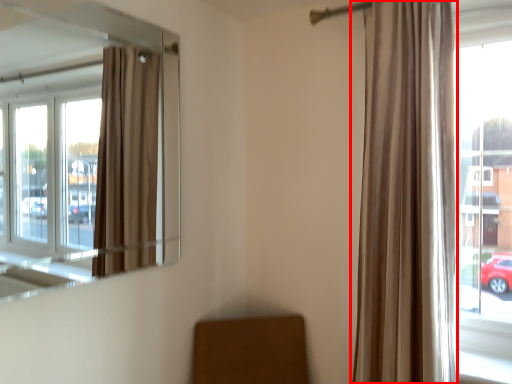
Question: Where is curtain (annotated by the red box) located in relation to window in the image?

Choices:
 (A) left
 (B) right

Answer: (B)